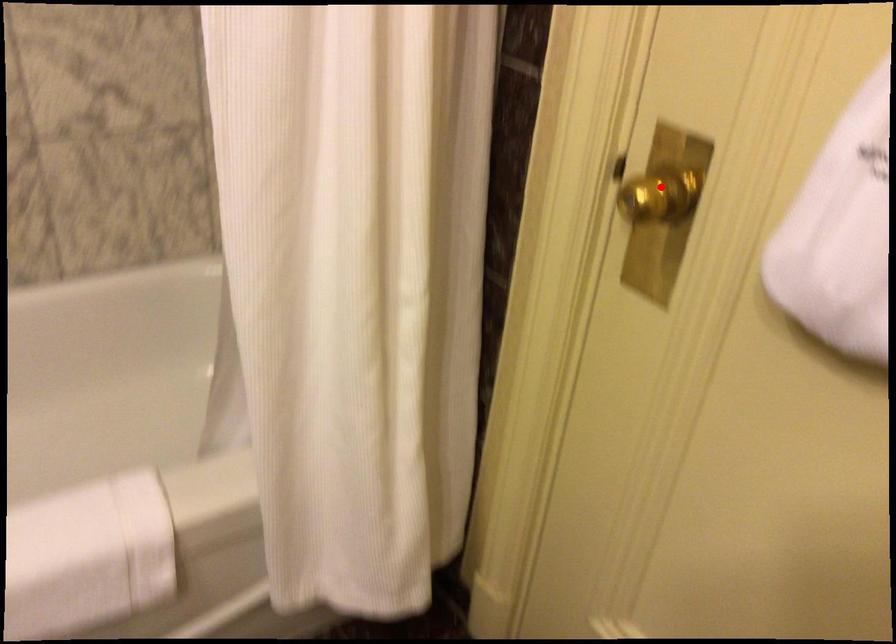
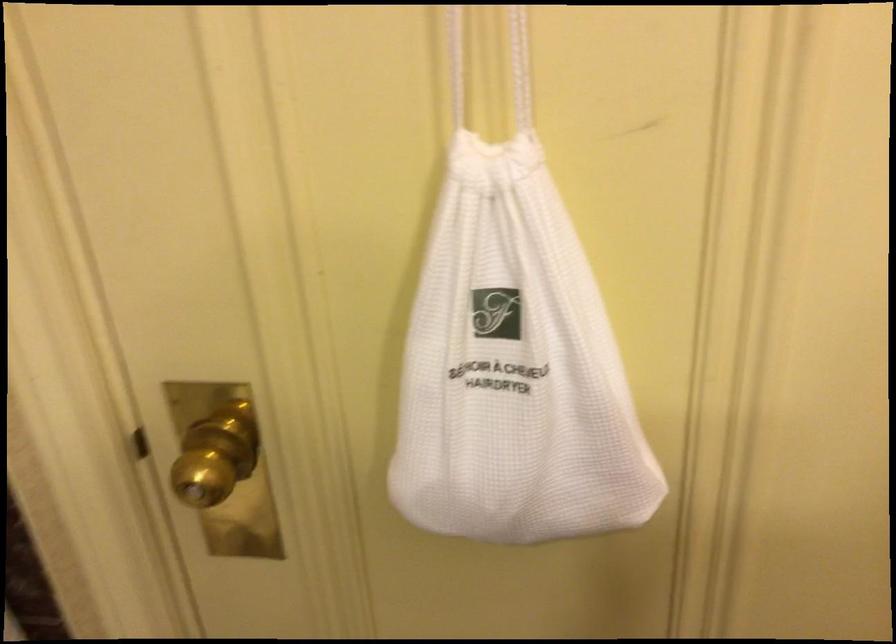
Where in the second image is the point corresponding to the highlighted location from the first image?

(216, 456)